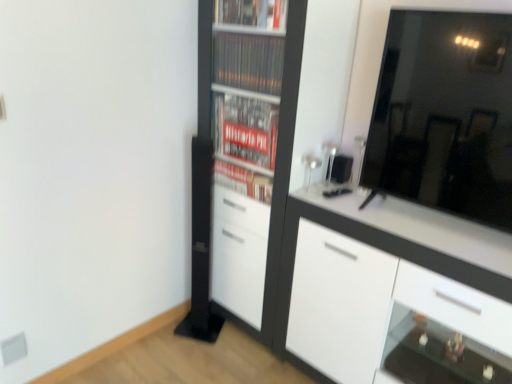
Image resolution: width=512 pixels, height=384 pixels. I want to click on free point below black glossy mirror at upper right (from a real-world perspective), so click(433, 226).